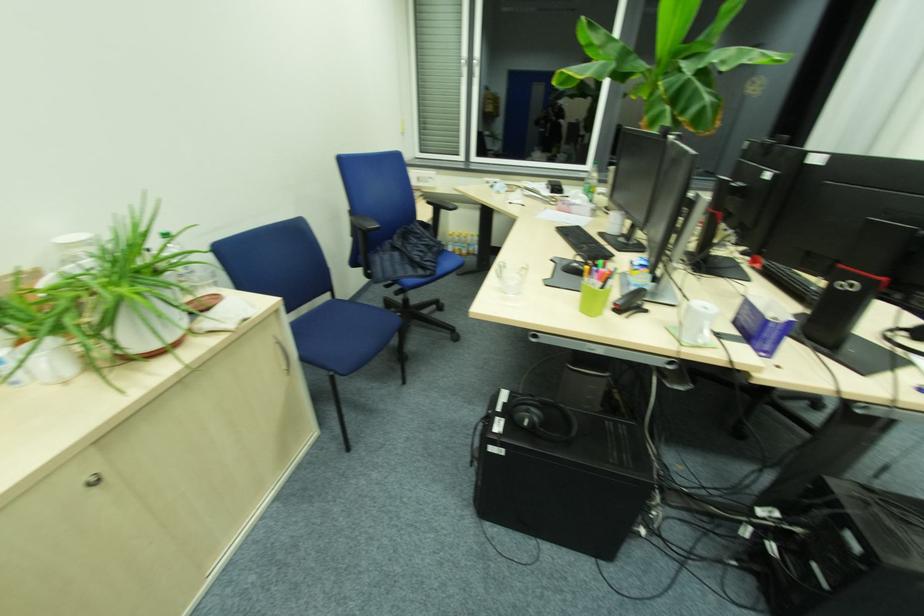
Which object does [629,302] point to?

It corresponds to the black smartphone in the image.